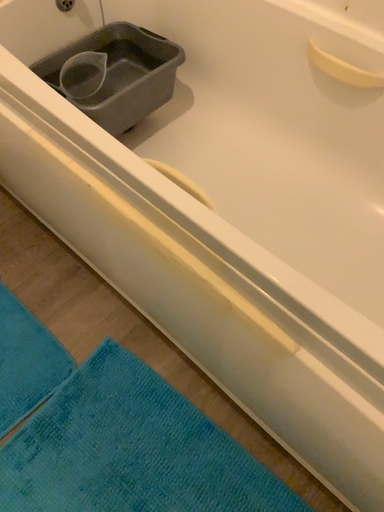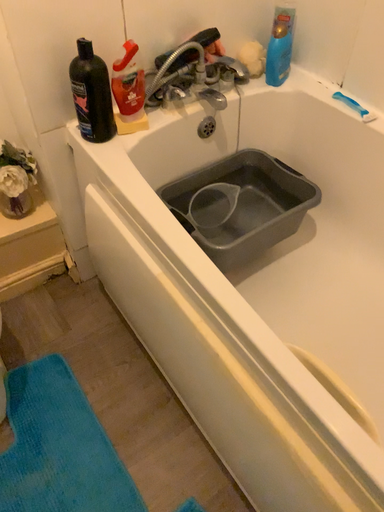
Question: How did the camera likely rotate when shooting the video?

Choices:
 (A) rotated downward
 (B) rotated upward

Answer: (B)